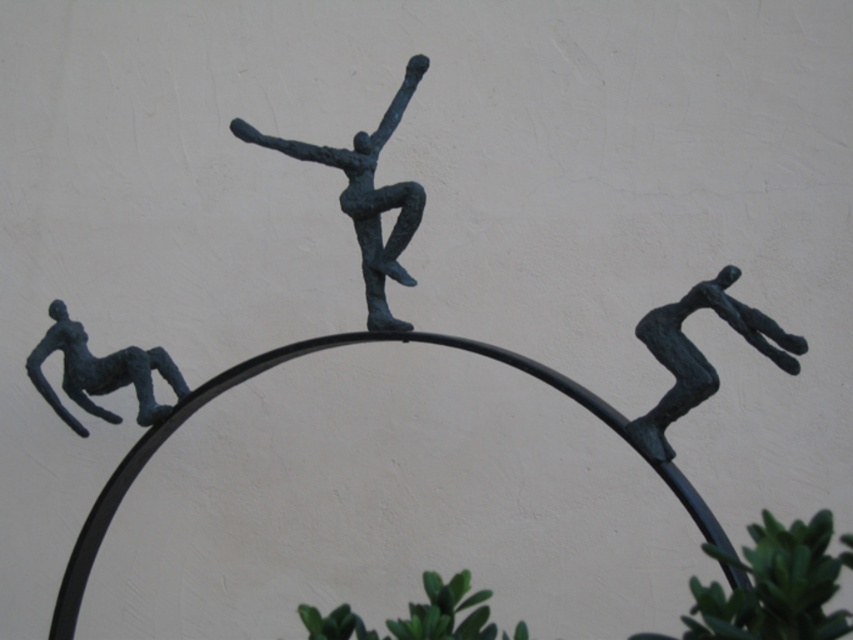
Looking at this image, is bronze figure at center above blue-green metal figure at lower left?

Yes, bronze figure at center is above blue-green metal figure at lower left.

How much distance is there between bronze figure at center and blue-green metal figure at lower left?

bronze figure at center and blue-green metal figure at lower left are 13.28 inches apart.

Locate an element on the screen. Image resolution: width=853 pixels, height=640 pixels. bronze figure at center is located at coordinates pos(367,196).

In order to click on bronze figure at center in this screenshot , I will do `click(367, 196)`.

Is point (793, 352) positioned before point (86, 352)?

Yes.

Between point (664, 449) and point (70, 369), which one is positioned behind?

The point (70, 369) is more distant.

The image size is (853, 640). I want to click on bronze figure at upper right, so tap(699, 355).

The image size is (853, 640). What are the coordinates of `bronze figure at center` in the screenshot? It's located at (367, 196).

Which is below, bronze figure at center or bronze figure at upper right?

Positioned lower is bronze figure at upper right.

What do you see at coordinates (367, 196) in the screenshot? This screenshot has height=640, width=853. I see `bronze figure at center` at bounding box center [367, 196].

I want to click on bronze figure at center, so click(x=367, y=196).